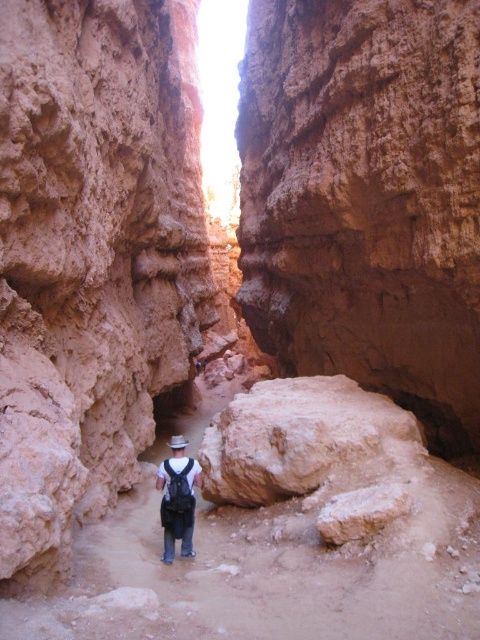
Which is above, smooth sandstone rock at center or matte black backpack at center?

smooth sandstone rock at center is higher up.

Is smooth sandstone rock at center to the right of matte black backpack at center from the viewer's perspective?

In fact, smooth sandstone rock at center is to the left of matte black backpack at center.

This screenshot has width=480, height=640. What do you see at coordinates (92, 257) in the screenshot?
I see `smooth sandstone rock at center` at bounding box center [92, 257].

Locate an element on the screen. The width and height of the screenshot is (480, 640). smooth sandstone rock at center is located at coordinates (92, 257).

Based on the photo, which is more to the left, smooth sandstone rock at center or rustic sandstone rock at center?

From the viewer's perspective, smooth sandstone rock at center appears more on the left side.

Measure the distance between smooth sandstone rock at center and rustic sandstone rock at center.

A distance of 10.14 meters exists between smooth sandstone rock at center and rustic sandstone rock at center.

Between point (61, 204) and point (444, 160), which one is positioned behind?

Point (444, 160)

Locate an element on the screen. The width and height of the screenshot is (480, 640). smooth sandstone rock at center is located at coordinates (92, 257).

Which of these two, rustic sandstone rock at center or matte black backpack at center, stands taller?

rustic sandstone rock at center

Is rustic sandstone rock at center thinner than matte black backpack at center?

In fact, rustic sandstone rock at center might be wider than matte black backpack at center.

This screenshot has height=640, width=480. I want to click on rustic sandstone rock at center, so click(x=365, y=198).

Identify the location of rustic sandstone rock at center. This screenshot has height=640, width=480. (365, 198).